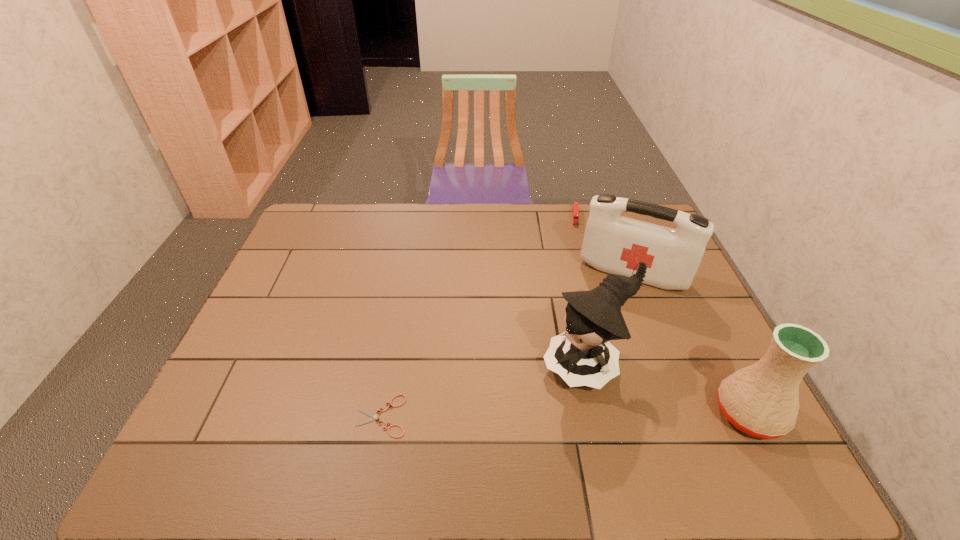
This screenshot has height=540, width=960. Identify the location of pottery situated at the near edge. (761, 400).

Where is `doll at the near edge`? The height and width of the screenshot is (540, 960). doll at the near edge is located at coordinates (582, 356).

Find the location of a particular element. pottery present at the right edge is located at coordinates (761, 400).

This screenshot has width=960, height=540. I want to click on the first-aid kit situated at the right edge, so click(612, 243).

The image size is (960, 540). I want to click on object located at the near right corner, so click(x=761, y=400).

Locate an element on the screen. This screenshot has width=960, height=540. vacant space at the far edge of the desktop is located at coordinates (532, 205).

In the image, there is a desktop. Where is `free space at the near edge`? This screenshot has height=540, width=960. free space at the near edge is located at coordinates (562, 428).

The height and width of the screenshot is (540, 960). I want to click on vacant area at the left edge, so click(279, 322).

The image size is (960, 540). In the image, there is a desktop. In order to click on vacant space at the right edge in this screenshot , I will do `click(679, 301)`.

In order to click on vacant space at the far left corner of the desktop in this screenshot , I will do `click(326, 208)`.